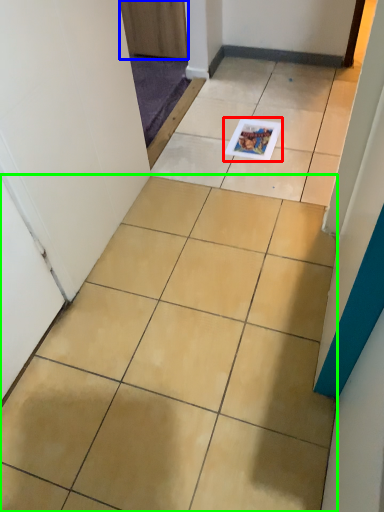
Question: Which object is the closest to the magazine (highlighted by a red box)? Choose among these: door (highlighted by a blue box) or ceramic tile (highlighted by a green box).

Choices:
 (A) door
 (B) ceramic tile

Answer: (A)